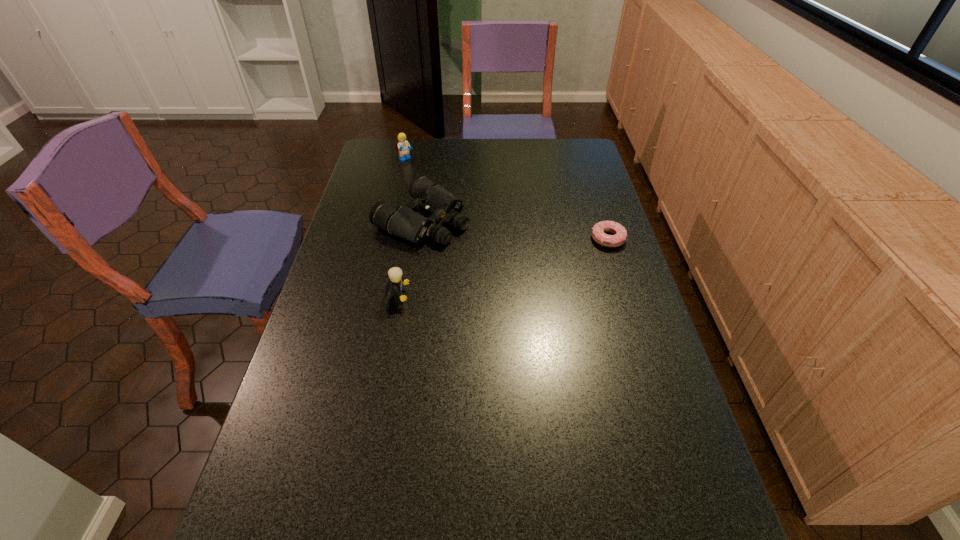
The width and height of the screenshot is (960, 540). In order to click on free region at the far edge of the desktop in this screenshot , I will do `click(523, 146)`.

Where is `vacant region at the near edge of the desktop`? The height and width of the screenshot is (540, 960). vacant region at the near edge of the desktop is located at coordinates (512, 511).

The height and width of the screenshot is (540, 960). Find the location of `vacant space at the left edge of the desktop`. vacant space at the left edge of the desktop is located at coordinates (366, 248).

Identify the location of vacant region at the right edge of the desktop. (604, 208).

In the image, there is a desktop. In order to click on vacant space at the far left corner in this screenshot , I will do `click(365, 165)`.

The image size is (960, 540). In order to click on free location at the far right corner of the desktop in this screenshot , I will do `click(584, 160)`.

The width and height of the screenshot is (960, 540). In the image, there is a desktop. Identify the location of vacant space at the near right corner. (637, 483).

Where is `unoccupied area between the nearest object and the binoculars`? unoccupied area between the nearest object and the binoculars is located at coordinates (410, 258).

This screenshot has width=960, height=540. I want to click on vacant space in between the rightmost object and the binoculars, so click(x=515, y=229).

Locate an element on the screen. The height and width of the screenshot is (540, 960). free space that is in between the binoculars and the rightmost object is located at coordinates (515, 229).